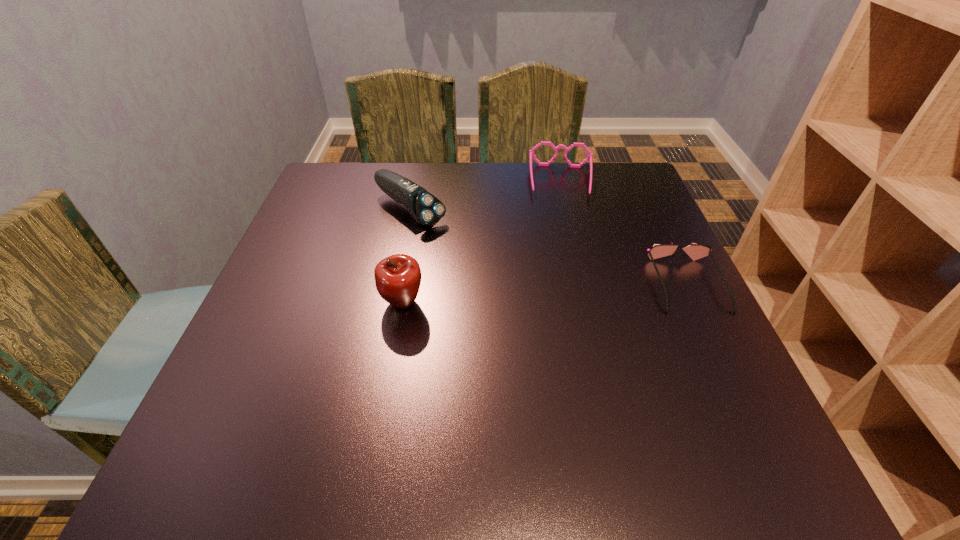
Identify the location of free space located on the head of the electric shaver. The width and height of the screenshot is (960, 540). (546, 306).

Find the location of `free space located on the arms of the spectacles`. free space located on the arms of the spectacles is located at coordinates (567, 282).

Where is `free space located on the arms of the spectacles`? This screenshot has height=540, width=960. free space located on the arms of the spectacles is located at coordinates (565, 249).

Locate an element on the screen. Image resolution: width=960 pixels, height=540 pixels. vacant space located 0.060m on the arms of the spectacles is located at coordinates (564, 214).

At what (x,y) coordinates should I click in order to perform the action: click on electric shaver that is positioned at the far edge. Please return your answer as a coordinate pair (x, y). Image resolution: width=960 pixels, height=540 pixels. Looking at the image, I should click on pos(426,209).

The width and height of the screenshot is (960, 540). In order to click on spectacles that is at the far edge in this screenshot , I will do `click(531, 152)`.

The width and height of the screenshot is (960, 540). Find the location of `sunglasses that is at the right edge`. sunglasses that is at the right edge is located at coordinates (695, 251).

This screenshot has width=960, height=540. I want to click on spectacles positioned at the right edge, so click(x=531, y=152).

Identify the location of object that is at the far right corner. This screenshot has height=540, width=960. (531, 152).

This screenshot has height=540, width=960. In the image, there is a desktop. Find the location of `blank space at the far edge`. blank space at the far edge is located at coordinates (512, 181).